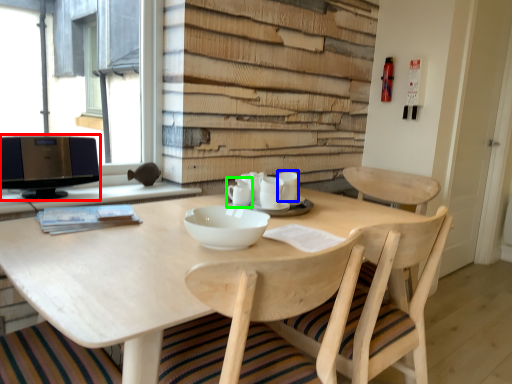
Question: Considering the real-world distances, which object is closest to computer monitor (highlighted by a red box)? tableware (highlighted by a blue box) or tableware (highlighted by a green box).

Choices:
 (A) tableware
 (B) tableware

Answer: (B)